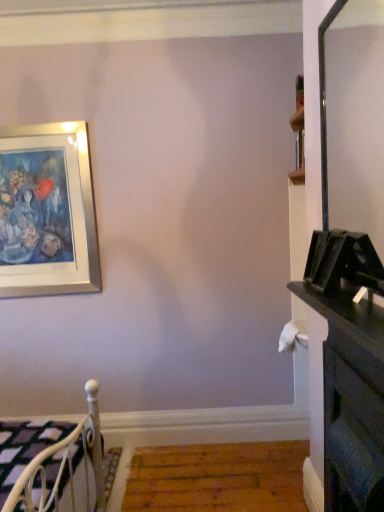
Describe the element at coordinates (65, 464) in the screenshot. I see `white metal bed at lower left` at that location.

At what (x,y) coordinates should I click in order to perform the action: click on white metal bed at lower left. Please return your answer as a coordinate pair (x, y). Image resolution: width=384 pixels, height=512 pixels. Looking at the image, I should click on (65, 464).

Image resolution: width=384 pixels, height=512 pixels. What are the coordinates of `black glossy dresser at lower right` in the screenshot? It's located at (351, 400).

The height and width of the screenshot is (512, 384). What do you see at coordinates (351, 400) in the screenshot?
I see `black glossy dresser at lower right` at bounding box center [351, 400].

Find the location of `white metal bed at lower left`. white metal bed at lower left is located at coordinates (65, 464).

Considering the relative positions of white metal bed at lower left and black glossy dresser at lower right in the image provided, is white metal bed at lower left to the right of black glossy dresser at lower right from the viewer's perspective?

No.

Is white metal bed at lower left in front of black glossy dresser at lower right?

That is False.

Does point (72, 437) lie behind point (325, 466)?

Yes.

From the image's perspective, is white metal bed at lower left above or below black glossy dresser at lower right?

Clearly, from the image's perspective, white metal bed at lower left is below black glossy dresser at lower right.

From a real-world perspective, who is located lower, white metal bed at lower left or black glossy dresser at lower right?

From a 3D spatial view, white metal bed at lower left is below.

Does white metal bed at lower left have a greater width compared to black glossy dresser at lower right?

Indeed, white metal bed at lower left has a greater width compared to black glossy dresser at lower right.

Can you confirm if white metal bed at lower left is taller than black glossy dresser at lower right?

No.

Is white metal bed at lower left bigger or smaller than black glossy dresser at lower right?

white metal bed at lower left is bigger than black glossy dresser at lower right.

Is white metal bed at lower left outside of black glossy dresser at lower right?

Indeed, white metal bed at lower left is completely outside black glossy dresser at lower right.

In the scene shown: Are white metal bed at lower left and black glossy dresser at lower right making contact?

No, white metal bed at lower left is not beside black glossy dresser at lower right.

Is white metal bed at lower left facing towards black glossy dresser at lower right?

Yes, white metal bed at lower left is facing black glossy dresser at lower right.

This screenshot has height=512, width=384. Identify the location of dresser lying on the right of white metal bed at lower left. (351, 400).

Is black glossy dresser at lower right to the right of white metal bed at lower left from the viewer's perspective?

Correct, you'll find black glossy dresser at lower right to the right of white metal bed at lower left.

From the picture: Which object is further away from the camera, black glossy dresser at lower right or white metal bed at lower left?

white metal bed at lower left.

Is point (329, 376) closer to camera compared to point (84, 467)?

Yes, it is in front of point (84, 467).

Consider the image. From the image's perspective, between black glossy dresser at lower right and white metal bed at lower left, who is located below?

From the image's view, white metal bed at lower left is below.

From a real-world perspective, is black glossy dresser at lower right below white metal bed at lower left?

Actually, black glossy dresser at lower right is physically above white metal bed at lower left in the real world.

Considering the sizes of objects black glossy dresser at lower right and white metal bed at lower left in the image provided, who is thinner, black glossy dresser at lower right or white metal bed at lower left?

With smaller width is black glossy dresser at lower right.

Does black glossy dresser at lower right have a lesser height compared to white metal bed at lower left?

No, black glossy dresser at lower right is not shorter than white metal bed at lower left.

Who is bigger, black glossy dresser at lower right or white metal bed at lower left?

Bigger between the two is white metal bed at lower left.

Is black glossy dresser at lower right positioned beyond the bounds of white metal bed at lower left?

black glossy dresser at lower right is positioned outside white metal bed at lower left.

Can you see black glossy dresser at lower right touching white metal bed at lower left?

There is a gap between black glossy dresser at lower right and white metal bed at lower left.

Could you tell me if black glossy dresser at lower right is turned towards white metal bed at lower left?

Yes.

What's the angular difference between black glossy dresser at lower right and white metal bed at lower left's facing directions?

177 degrees.

How much distance is there between black glossy dresser at lower right and white metal bed at lower left?

A distance of 37.81 inches exists between black glossy dresser at lower right and white metal bed at lower left.

Identify the location of furniture directly beneath the black glossy dresser at lower right (from a real-world perspective). (65, 464).

Find the location of a particular element. This screenshot has width=384, height=512. dresser located above the white metal bed at lower left (from the image's perspective) is located at coordinates (351, 400).

This screenshot has height=512, width=384. Find the location of `dresser in front of the white metal bed at lower left`. dresser in front of the white metal bed at lower left is located at coordinates (351, 400).